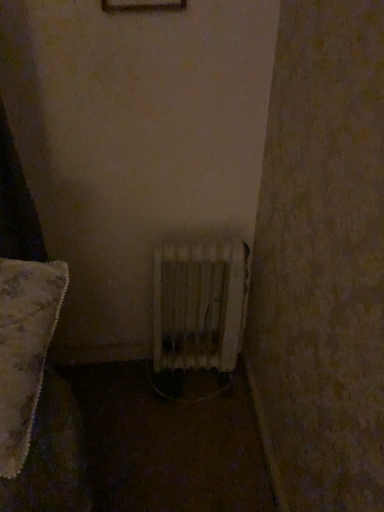
Measure the distance between white textured radiator at center and camera.

white textured radiator at center and camera are 1.35 meters apart.

What do you see at coordinates (199, 304) in the screenshot? I see `white textured radiator at center` at bounding box center [199, 304].

Where is `white textured radiator at center`? white textured radiator at center is located at coordinates (199, 304).

In order to face white textured radiator at center, should I rotate leftwards or rightwards?

You should rotate right by 0.750 degrees.

Locate an element on the screen. white textured radiator at center is located at coordinates (199, 304).